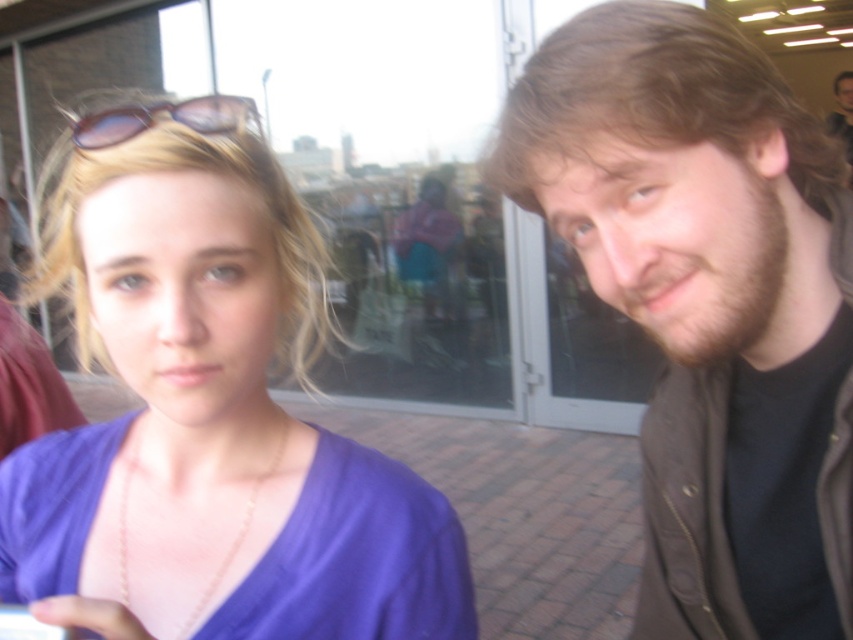
Question: Is purple matte shirt at left positioned in front of brown hair at right?

Choices:
 (A) no
 (B) yes

Answer: (B)

Question: Which of these objects is positioned closest to the brown hair at upper right?

Choices:
 (A) sunglasses at upper left
 (B) purple matte shirt at left
 (C) brown hair at right

Answer: (C)

Question: In this image, where is purple matte shirt at left located relative to brown hair at right?

Choices:
 (A) left
 (B) right

Answer: (A)

Question: Can you confirm if brown hair at right is wider than sunglasses at upper left?

Choices:
 (A) yes
 (B) no

Answer: (A)

Question: Which point is farther from the camera taking this photo?

Choices:
 (A) (93, 593)
 (B) (780, 452)

Answer: (B)

Question: Which of the following is the closest to the observer?

Choices:
 (A) brown hair at right
 (B) sunglasses at upper left
 (C) brown hair at upper right

Answer: (A)